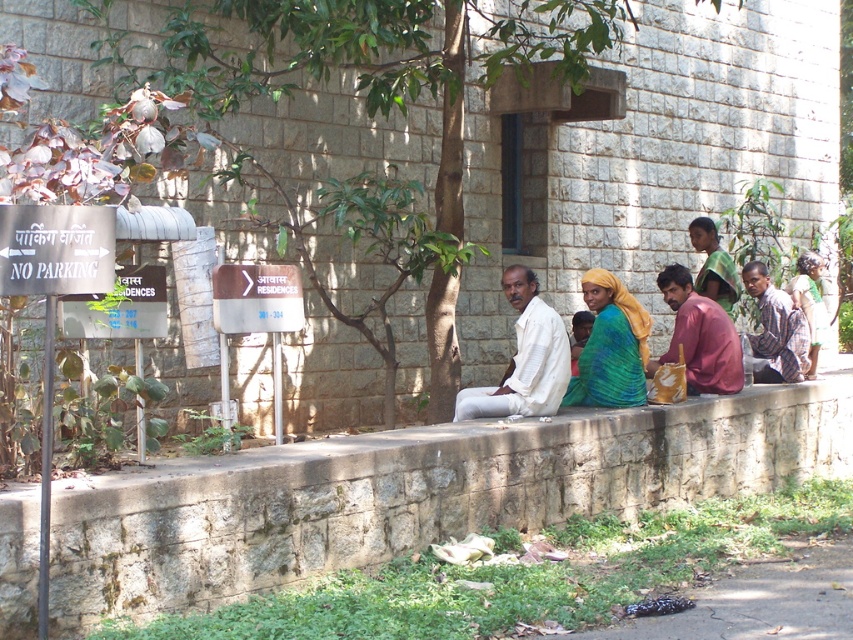
You are a photographer taking a picture of the scene. You want to focus on the white cotton shirt at center and the green fabric headscarf at upper right. Which one will appear larger in the photo?

The white cotton shirt at center will appear larger in the photo because it is closer to the viewer than the green fabric headscarf at upper right.

You are standing in front of the building with the small window and want to take a photo of the group on the low stone wall. The green leafy tree at center might block your view. Based on its position, can you determine if the tree is between you and the group?

The green leafy tree at center is located at point (x=370, y=116), which places it at the center of the image. Since the group is sitting on the low stone wall in front of the building, the tree is likely between you and the group, potentially blocking the view.